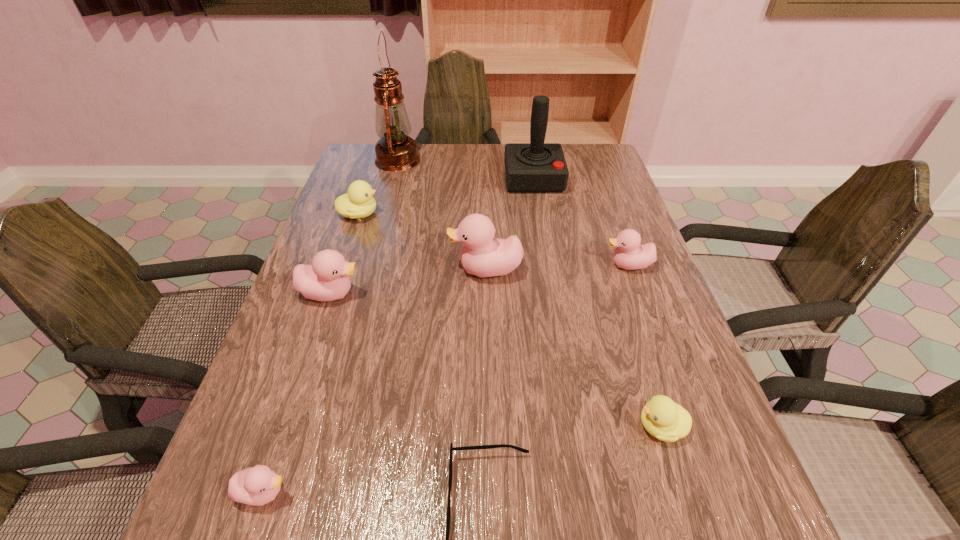
You are a GUI agent. You are given a task and a screenshot of the screen. Output one action in this format:
    pyautogui.click(x=<x>, y=<y>)
    Task: Click on the smaller yellow duckling
    
    Given the screenshot: What is the action you would take?
    pyautogui.click(x=667, y=421)

Where is `the nearer yellow duckling`? Image resolution: width=960 pixels, height=540 pixels. the nearer yellow duckling is located at coordinates (667, 421).

The width and height of the screenshot is (960, 540). Identify the location of the smallest pink duckling. (259, 485).

Find the location of a particular element. The image size is (960, 540). the nearest pink duckling is located at coordinates point(259,485).

Image resolution: width=960 pixels, height=540 pixels. Identify the location of vacant space positioned 0.270m on the right of the oil lamp. (502, 160).

Where is `vacant space located 0.080m on the base of the red joystick`? vacant space located 0.080m on the base of the red joystick is located at coordinates (539, 211).

The width and height of the screenshot is (960, 540). I want to click on free space located on the front-facing side of the second pink duckling from right to left, so click(x=368, y=269).

This screenshot has width=960, height=540. I want to click on free space located 0.110m on the front-facing side of the second pink duckling from right to left, so click(x=404, y=269).

Identify the location of vacant region located 0.070m on the front-facing side of the second pink duckling from right to left. This screenshot has height=540, width=960. (420, 269).

In order to click on vacant area situated on the front-facing side of the fifth shortest duckling in this screenshot , I will do `click(437, 293)`.